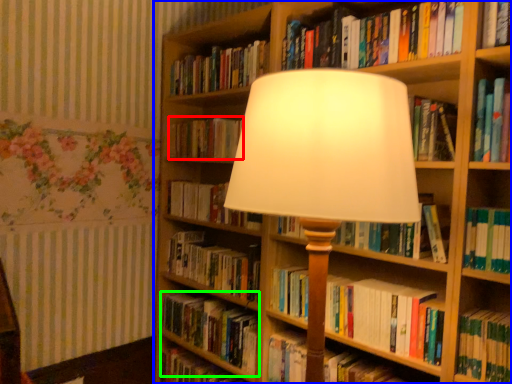
Question: Which object is positioned farthest from book (highlighted by a red box)? Select from bookcase (highlighted by a blue box) and book (highlighted by a green box).

Choices:
 (A) bookcase
 (B) book

Answer: (B)